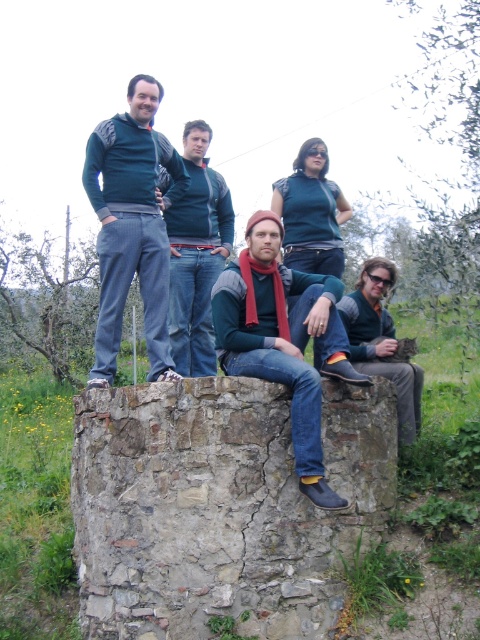
Question: Which of the following is the farthest from the observer?

Choices:
 (A) (156, 100)
 (B) (273, 284)
 (C) (348, 308)

Answer: (A)

Question: Is matte green sweater at upper left thinner than dark blue sweater at center?

Choices:
 (A) no
 (B) yes

Answer: (A)

Question: Does knit wool scarf at center appear on the right side of dark blue sweater at center?

Choices:
 (A) no
 (B) yes

Answer: (B)

Question: Does rusty concrete wall at center have a greater width compared to knit wool scarf at center?

Choices:
 (A) yes
 (B) no

Answer: (A)

Question: Which of the following is the farthest from the observer?

Choices:
 (A) rusty concrete wall at center
 (B) dark blue sweater at center

Answer: (B)

Question: Which of these objects is positioned closest to the knit wool scarf at center?

Choices:
 (A) rusty concrete wall at center
 (B) matte green sweater at upper left
 (C) dark blue sweater at center

Answer: (A)